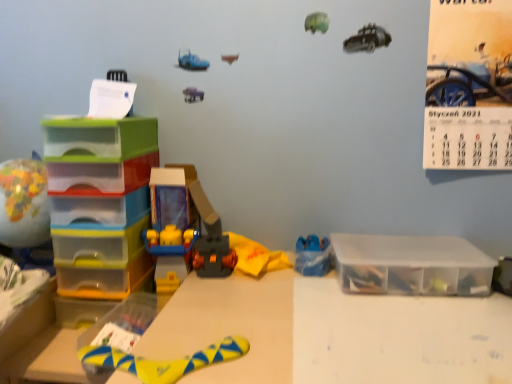
Identify the location of rubberized plastic toy at center, arranged as the second toy when viewed from the left. (184, 226).

This screenshot has height=384, width=512. What do you see at coordinates (164, 360) in the screenshot?
I see `yellow rubber toy at lower center, the 3th toy viewed from the left` at bounding box center [164, 360].

The image size is (512, 384). In order to click on multicolored plastic globe at left, which ranks as the fourth toy in right-to-left order in this screenshot , I will do `click(25, 211)`.

Locate an element on the screen. The height and width of the screenshot is (384, 512). clear plastic storage box at right is located at coordinates (411, 265).

Measure the distance between point [101,125] and camera.

The depth of point [101,125] is 36.06 inches.

Identify the location of rubberized plastic toy at center, arranged as the second toy when viewed from the left. This screenshot has width=512, height=384. (184, 226).

Based on the photo, is translucent plastic drawers at left not near yellow rubber toy at lower center, which is counted as the 2th toy, starting from the right?

That's not correct — translucent plastic drawers at left is a little close to yellow rubber toy at lower center, which is counted as the 2th toy, starting from the right.

Between point (91, 164) and point (141, 363), which one is positioned behind?

Point (91, 164)

Looking at this image, is clear plastic storage box at right in contact with yellow paper calendar at upper right?

No, clear plastic storage box at right is not next to yellow paper calendar at upper right.

From a real-world perspective, is clear plastic storage box at right physically below yellow paper calendar at upper right?

Correct, in the physical world, clear plastic storage box at right is lower than yellow paper calendar at upper right.

Between clear plastic storage box at right and yellow paper calendar at upper right, which one has less height?

clear plastic storage box at right.

Between point (378, 286) and point (489, 81), which one is positioned in front?

The point (378, 286) is in front.

Considering the sizes of objects yellow rubber toy at lower center, the 3th toy viewed from the left, and multicolored plastic globe at left, the 1th toy when ordered from left to right, in the image provided, who is shorter, yellow rubber toy at lower center, the 3th toy viewed from the left, or multicolored plastic globe at left, the 1th toy when ordered from left to right,?

yellow rubber toy at lower center, the 3th toy viewed from the left.

Would you consider yellow rubber toy at lower center, the 3th toy viewed from the left, to be distant from multicolored plastic globe at left, which ranks as the fourth toy in right-to-left order?

That's not correct — yellow rubber toy at lower center, the 3th toy viewed from the left, is a little close to multicolored plastic globe at left, which ranks as the fourth toy in right-to-left order.

Considering the points (133, 363) and (45, 177), which point is in front, point (133, 363) or point (45, 177)?

Point (133, 363)

Can you confirm if yellow rubber toy at lower center, the 3th toy viewed from the left, is thinner than multicolored plastic globe at left, the 1th toy when ordered from left to right?

No.

Is multicolored plastic globe at left, which ranks as the fourth toy in right-to-left order, spatially inside yellow rubber toy at lower center, which is counted as the 2th toy, starting from the right, or outside of it?

multicolored plastic globe at left, which ranks as the fourth toy in right-to-left order, is spatially situated outside yellow rubber toy at lower center, which is counted as the 2th toy, starting from the right.

Who is taller, multicolored plastic globe at left, the 1th toy when ordered from left to right, or yellow rubber toy at lower center, which is counted as the 2th toy, starting from the right?

multicolored plastic globe at left, the 1th toy when ordered from left to right, is taller.

Would you consider multicolored plastic globe at left, which ranks as the fourth toy in right-to-left order, to be distant from yellow rubber toy at lower center, which is counted as the 2th toy, starting from the right?

No, multicolored plastic globe at left, which ranks as the fourth toy in right-to-left order, is not far away from yellow rubber toy at lower center, which is counted as the 2th toy, starting from the right.

Between multicolored plastic globe at left, which ranks as the fourth toy in right-to-left order, and yellow rubber toy at lower center, which is counted as the 2th toy, starting from the right, which one is positioned in front?

yellow rubber toy at lower center, which is counted as the 2th toy, starting from the right.

Consider the image. Which of these two, blue plastic toy at center-right, which ranks as the fourth toy in left-to-right order, or yellow rubber toy at lower center, which is counted as the 2th toy, starting from the right, is smaller?

Smaller between the two is blue plastic toy at center-right, which ranks as the fourth toy in left-to-right order.

From the image's perspective, is blue plastic toy at center-right, which ranks as the fourth toy in left-to-right order, on yellow rubber toy at lower center, the 3th toy viewed from the left?

Correct, blue plastic toy at center-right, which ranks as the fourth toy in left-to-right order, appears higher than yellow rubber toy at lower center, the 3th toy viewed from the left, in the image.

Consider the image. Is blue plastic toy at center-right, which is counted as the first toy, starting from the right, oriented towards yellow rubber toy at lower center, which is counted as the 2th toy, starting from the right?

No, blue plastic toy at center-right, which is counted as the first toy, starting from the right, is not oriented towards yellow rubber toy at lower center, which is counted as the 2th toy, starting from the right.

From the image's perspective, is multicolored plastic globe at left, the 1th toy when ordered from left to right, above or below yellow paper calendar at upper right?

multicolored plastic globe at left, the 1th toy when ordered from left to right, is situated lower than yellow paper calendar at upper right in the image.

Is multicolored plastic globe at left, the 1th toy when ordered from left to right, bigger or smaller than yellow paper calendar at upper right?

Clearly, multicolored plastic globe at left, the 1th toy when ordered from left to right, is smaller in size than yellow paper calendar at upper right.

How much distance is there between multicolored plastic globe at left, the 1th toy when ordered from left to right, and yellow paper calendar at upper right?

multicolored plastic globe at left, the 1th toy when ordered from left to right, and yellow paper calendar at upper right are 99.47 centimeters apart from each other.

Can we say multicolored plastic globe at left, which ranks as the fourth toy in right-to-left order, lies outside yellow paper calendar at upper right?

Indeed, multicolored plastic globe at left, which ranks as the fourth toy in right-to-left order, is completely outside yellow paper calendar at upper right.

In the scene shown: Could clear plastic storage box at right be considered to be inside blue plastic toy at center-right, which is counted as the first toy, starting from the right?

No, blue plastic toy at center-right, which is counted as the first toy, starting from the right, does not contain clear plastic storage box at right.

Is clear plastic storage box at right at the back of blue plastic toy at center-right, which is counted as the first toy, starting from the right?

That's not correct — blue plastic toy at center-right, which is counted as the first toy, starting from the right, is not looking away from clear plastic storage box at right.

Is point (315, 266) positioned after point (405, 290)?

Yes, point (315, 266) is behind point (405, 290).

Which object is thinner, blue plastic toy at center-right, which ranks as the fourth toy in left-to-right order, or clear plastic storage box at right?

blue plastic toy at center-right, which ranks as the fourth toy in left-to-right order, is thinner.

Where is `shelf that appears on the left of yellow rubber toy at lower center, which is counted as the 2th toy, starting from the right`? shelf that appears on the left of yellow rubber toy at lower center, which is counted as the 2th toy, starting from the right is located at coordinates (100, 202).

Locate an element on the screen. The width and height of the screenshot is (512, 384). poster page in front of the clear plastic storage box at right is located at coordinates (469, 85).

Estimate the real-world distances between objects in this image. Which object is further from translucent plastic drawers at left, yellow paper calendar at upper right or yellow rubber toy at lower center, which is counted as the 2th toy, starting from the right?

The object further to translucent plastic drawers at left is yellow paper calendar at upper right.

From the image, which object appears to be nearer to rubberized plastic toy at center, the 3th toy viewed from the right, yellow rubber toy at lower center, the 3th toy viewed from the left, or yellow paper calendar at upper right?

The object closer to rubberized plastic toy at center, the 3th toy viewed from the right, is yellow rubber toy at lower center, the 3th toy viewed from the left.

When comparing their distances from multicolored plastic globe at left, which ranks as the fourth toy in right-to-left order, does blue plastic toy at center-right, which ranks as the fourth toy in left-to-right order, or clear plastic storage box at right seem further?

Among the two, clear plastic storage box at right is located further to multicolored plastic globe at left, which ranks as the fourth toy in right-to-left order.

Estimate the real-world distances between objects in this image. Which object is closer to translucent plastic drawers at left, blue plastic toy at center-right, which ranks as the fourth toy in left-to-right order, or yellow paper calendar at upper right?

blue plastic toy at center-right, which ranks as the fourth toy in left-to-right order, is positioned closer to the anchor translucent plastic drawers at left.

Estimate the real-world distances between objects in this image. Which object is further from rubberized plastic toy at center, the 3th toy viewed from the right, clear plastic storage box at right or translucent plastic drawers at left?

clear plastic storage box at right is further to rubberized plastic toy at center, the 3th toy viewed from the right.

Consider the image. When comparing their distances from yellow paper calendar at upper right, does translucent plastic drawers at left or clear plastic storage box at right seem closer?

The object closer to yellow paper calendar at upper right is clear plastic storage box at right.

When comparing their distances from clear plastic storage box at right, does translucent plastic drawers at left or yellow paper calendar at upper right seem closer?

Based on the image, yellow paper calendar at upper right appears to be nearer to clear plastic storage box at right.

Considering their positions, is blue plastic toy at center-right, which is counted as the first toy, starting from the right, positioned further to rubberized plastic toy at center, arranged as the second toy when viewed from the left, than multicolored plastic globe at left, which ranks as the fourth toy in right-to-left order?

multicolored plastic globe at left, which ranks as the fourth toy in right-to-left order.

Where is `shelf positioned between yellow rubber toy at lower center, which is counted as the 2th toy, starting from the right, and rubberized plastic toy at center, the 3th toy viewed from the right, from near to far`? The image size is (512, 384). shelf positioned between yellow rubber toy at lower center, which is counted as the 2th toy, starting from the right, and rubberized plastic toy at center, the 3th toy viewed from the right, from near to far is located at coordinates (100, 202).

The width and height of the screenshot is (512, 384). What are the coordinates of `shelf between yellow rubber toy at lower center, which is counted as the 2th toy, starting from the right, and multicolored plastic globe at left, which ranks as the fourth toy in right-to-left order, along the z-axis` in the screenshot? It's located at (100, 202).

I want to click on shelf between multicolored plastic globe at left, the 1th toy when ordered from left to right, and clear plastic storage box at right, in the horizontal direction, so click(100, 202).

Where is `storage box between translucent plastic drawers at left and yellow paper calendar at upper right`? storage box between translucent plastic drawers at left and yellow paper calendar at upper right is located at coordinates (411, 265).